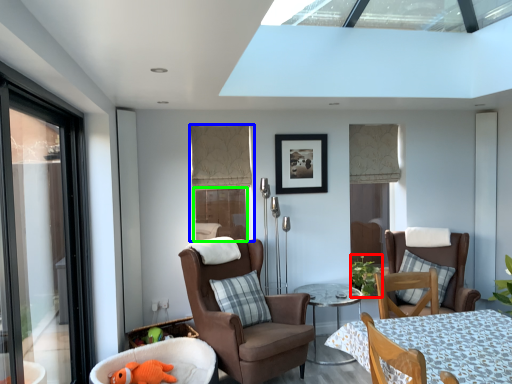
Question: Based on their relative distances, which object is farther from plant (highlighted by a red box)? Choose from window (highlighted by a blue box) and window (highlighted by a green box).

Choices:
 (A) window
 (B) window

Answer: (A)